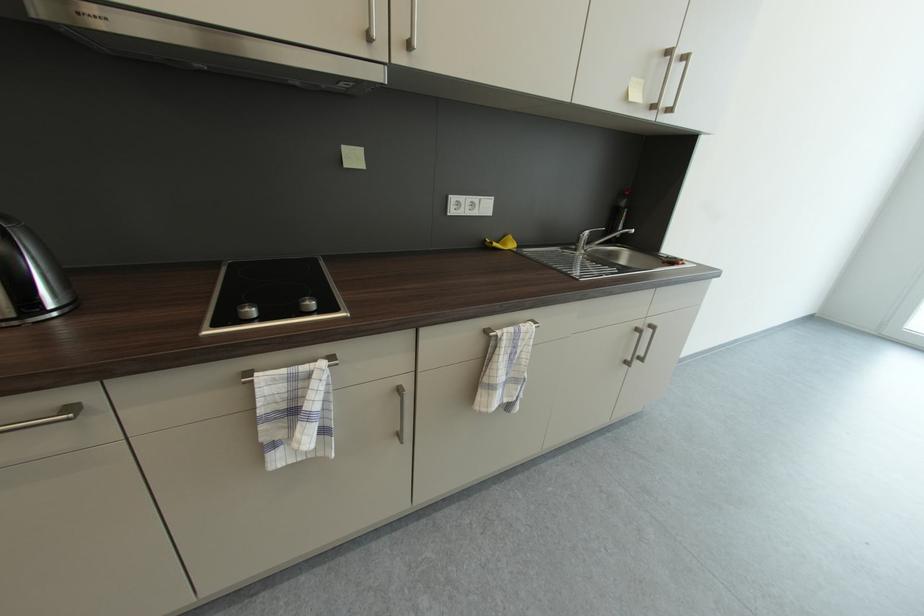
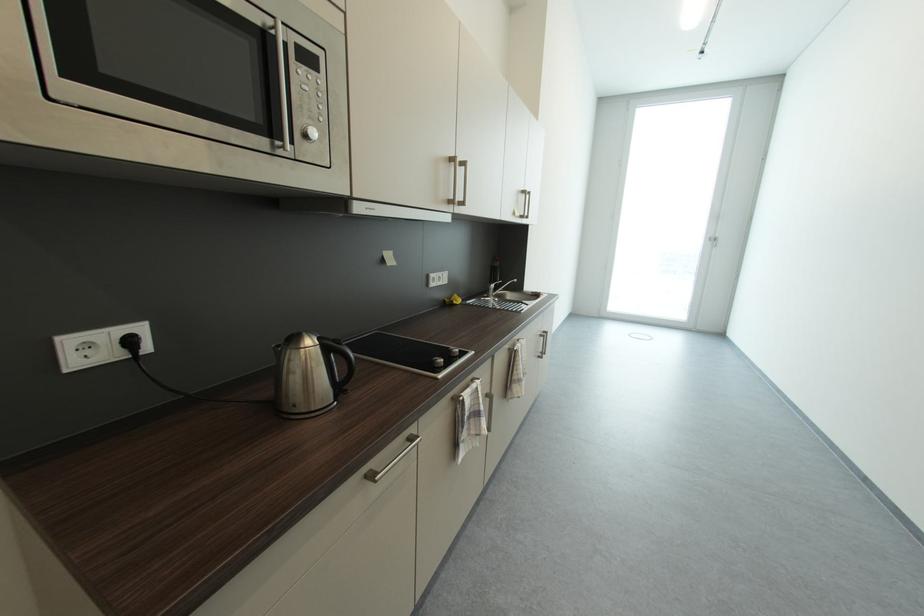
Where in the second image is the point corresponding to the point at 592,235 from the first image?

(499, 286)